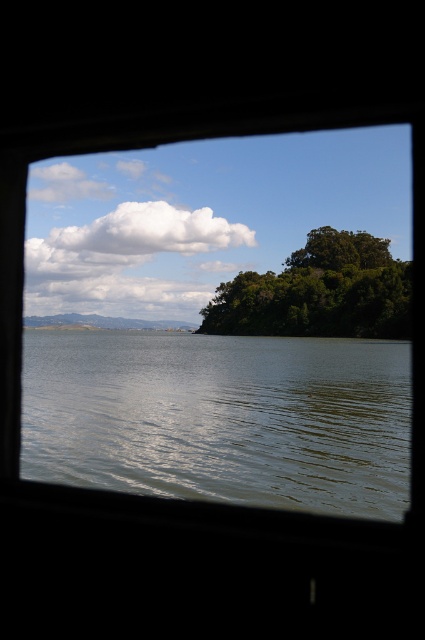
Question: Is greenish reflective water at center closer to the viewer compared to green leafy tree at center?

Choices:
 (A) yes
 (B) no

Answer: (A)

Question: Which point is farther from the camera taking this photo?

Choices:
 (A) (405, 365)
 (B) (388, 280)

Answer: (B)

Question: Which of the following is the closest to the observer?

Choices:
 (A) green leafy tree at center
 (B) greenish reflective water at center

Answer: (B)

Question: Is the position of transparent glass window at center less distant than that of greenish reflective water at center?

Choices:
 (A) no
 (B) yes

Answer: (B)

Question: Which object appears closest to the camera in this image?

Choices:
 (A) transparent glass window at center
 (B) green leafy tree at center

Answer: (A)

Question: Does greenish reflective water at center appear over green leafy tree at center?

Choices:
 (A) yes
 (B) no

Answer: (B)